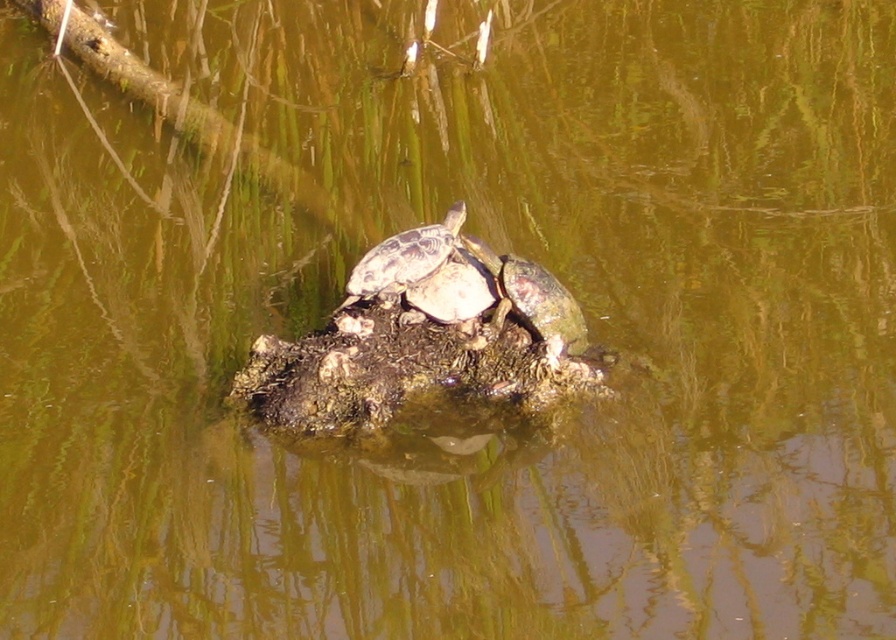
Question: Which of the following is the farthest from the observer?

Choices:
 (A) greenish-brown scaly tortoise at center
 (B) smooth gray tortoise at center
 (C) shiny brown tortoise at center

Answer: (B)

Question: Which object is the closest to the shiny brown tortoise at center?

Choices:
 (A) smooth gray tortoise at center
 (B) greenish-brown scaly tortoise at center

Answer: (A)

Question: Does shiny brown tortoise at center have a greater width compared to smooth gray tortoise at center?

Choices:
 (A) yes
 (B) no

Answer: (A)

Question: Which of these objects is positioned closest to the greenish-brown scaly tortoise at center?

Choices:
 (A) smooth gray tortoise at center
 (B) shiny brown tortoise at center

Answer: (A)

Question: Observing the image, what is the correct spatial positioning of greenish-brown scaly tortoise at center in reference to shiny brown tortoise at center?

Choices:
 (A) below
 (B) above

Answer: (A)

Question: Can you confirm if shiny brown tortoise at center is smaller than smooth gray tortoise at center?

Choices:
 (A) yes
 (B) no

Answer: (B)